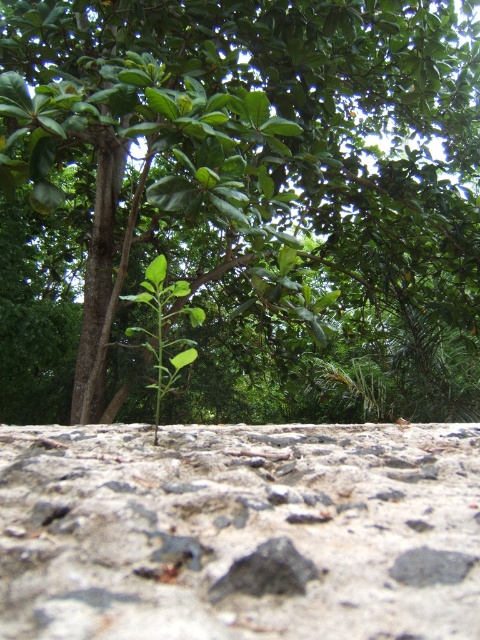
Describe the element at coordinates (262, 192) in the screenshot. I see `green leafy tree at center` at that location.

Does green leafy tree at center come behind gray rough concrete at center?

That is True.

Image resolution: width=480 pixels, height=640 pixels. Identify the location of green leafy tree at center. tap(262, 192).

Locate an element on the screen. The width and height of the screenshot is (480, 640). green leafy tree at center is located at coordinates (262, 192).